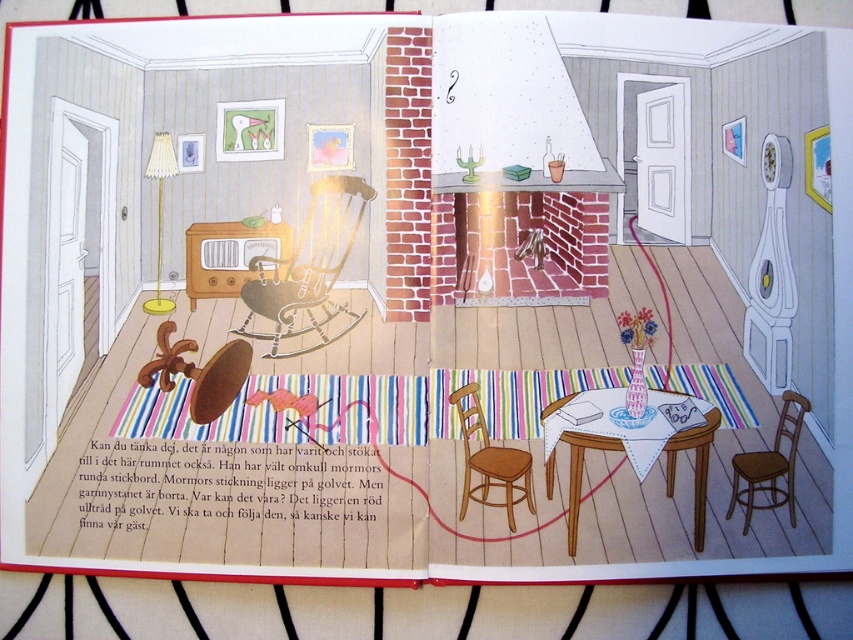
Does wooden chair at center appear on the right side of white paper at center?

Incorrect, wooden chair at center is not on the right side of white paper at center.

Between point (479, 422) and point (595, 412), which one is positioned in front?

Point (479, 422) is in front.

Find the location of `wooden chair at center`. wooden chair at center is located at coordinates (489, 460).

Is white cloth-covered table at center to the right of wooden chair at lower right from the viewer's perspective?

In fact, white cloth-covered table at center is to the left of wooden chair at lower right.

At what (x,y) coordinates should I click in order to perform the action: click on white cloth-covered table at center. Please return your answer as a coordinate pair (x, y). The height and width of the screenshot is (640, 853). Looking at the image, I should click on (694, 467).

This screenshot has height=640, width=853. In order to click on white cloth-covered table at center in this screenshot , I will do `click(694, 467)`.

Can you confirm if metallic silver rocking chair at center is positioned above white paper book at center?

Correct, metallic silver rocking chair at center is located above white paper book at center.

The height and width of the screenshot is (640, 853). Describe the element at coordinates (308, 269) in the screenshot. I see `metallic silver rocking chair at center` at that location.

Locate an element on the screen. metallic silver rocking chair at center is located at coordinates (308, 269).